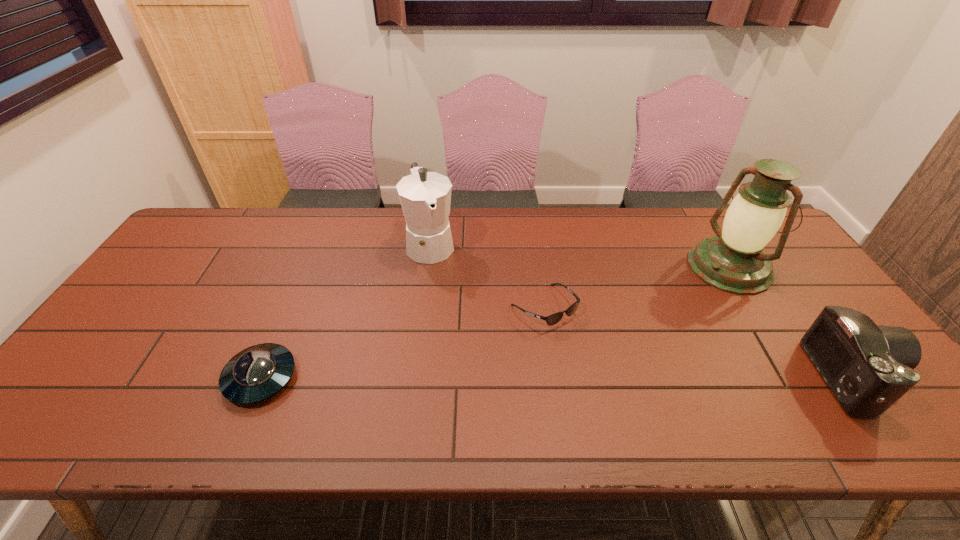
Locate an element on the screen. free location that satisfies the following two spatial constraints: 1. on the front side of the tallest object; 2. on the lens of the third tallest object is located at coordinates (798, 377).

Locate an element on the screen. The image size is (960, 540). vacant region that satisfies the following two spatial constraints: 1. on the back side of the leftmost object; 2. on the lens of the camera is located at coordinates (261, 377).